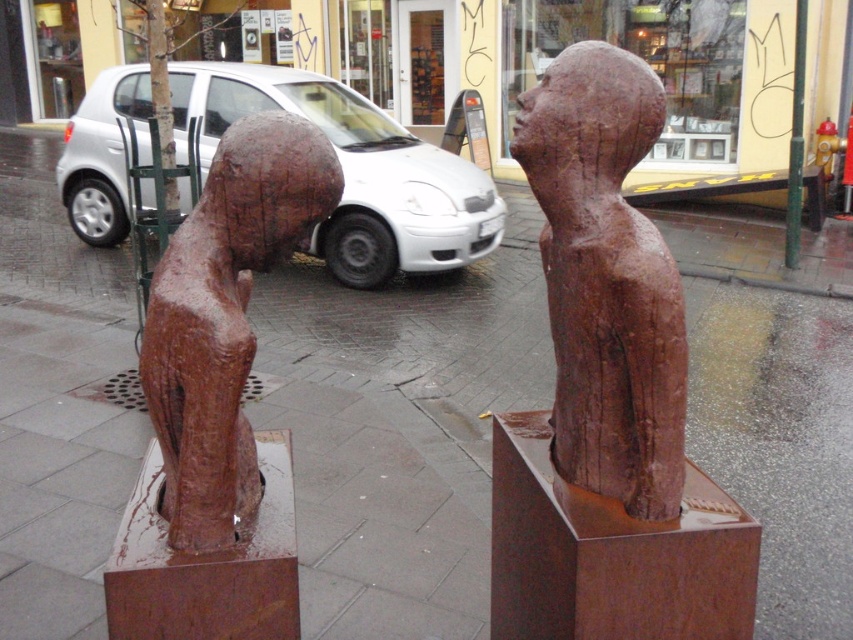
Is rusty wood statue at center further to camera compared to silver metallic car at center?

No.

Describe the element at coordinates (606, 280) in the screenshot. I see `rusty wood statue at center` at that location.

Measure the distance between point (567, 195) and camera.

Point (567, 195) is 6.07 feet from camera.

I want to click on rusty wood statue at center, so click(x=606, y=280).

Is rusty wood statue at center below rusty bronze statue at left?

Incorrect, rusty wood statue at center is not positioned below rusty bronze statue at left.

Is rusty wood statue at center bigger than rusty bronze statue at left?

Indeed, rusty wood statue at center has a larger size compared to rusty bronze statue at left.

This screenshot has height=640, width=853. What are the coordinates of `rusty wood statue at center` in the screenshot? It's located at (606, 280).

Between point (292, 128) and point (100, 148), which one is positioned behind?

Positioned behind is point (100, 148).

The image size is (853, 640). Describe the element at coordinates (224, 317) in the screenshot. I see `rusty bronze statue at left` at that location.

Where is `rusty bronze statue at left`? The width and height of the screenshot is (853, 640). rusty bronze statue at left is located at coordinates (224, 317).